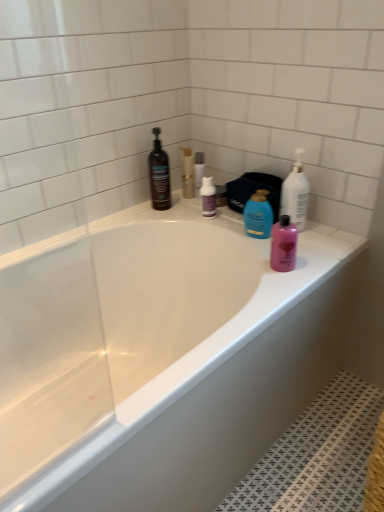
Locate an element on the screen. This screenshot has height=512, width=384. vacant area that lies to the right of pink glossy bottle at right, the third toiletry when ordered from left to right is located at coordinates (319, 257).